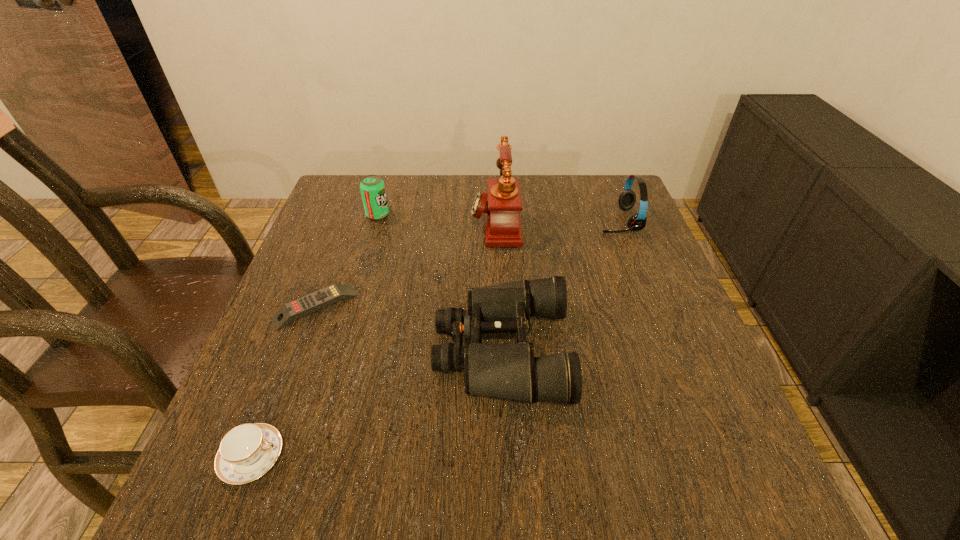
The image size is (960, 540). Identify the location of headset located in the far edge section of the desktop. (627, 199).

The image size is (960, 540). Find the location of `pop soda that is at the far edge`. pop soda that is at the far edge is located at coordinates (372, 187).

Where is `object present at the near edge`? The width and height of the screenshot is (960, 540). object present at the near edge is located at coordinates (x=248, y=451).

The image size is (960, 540). Identify the location of pop soda situated at the left edge. (372, 187).

At what (x,y) coordinates should I click in order to perform the action: click on teacup present at the left edge. Please return your answer as a coordinate pair (x, y). Looking at the image, I should click on (248, 451).

You are a GUI agent. You are given a task and a screenshot of the screen. Output one action in this format:
    pyautogui.click(x=<x>, y=<y>)
    Task: Click on the remote control that is at the left edge
    
    Given the screenshot: What is the action you would take?
    pyautogui.click(x=305, y=305)

Where is `object that is at the right edge`? The width and height of the screenshot is (960, 540). object that is at the right edge is located at coordinates (627, 199).

Identify the location of object that is positioned at the far left corner. The height and width of the screenshot is (540, 960). (372, 187).

This screenshot has width=960, height=540. Find the location of `object that is at the near left corner`. object that is at the near left corner is located at coordinates (248, 451).

Where is `object that is at the far right corner`? The image size is (960, 540). object that is at the far right corner is located at coordinates (627, 199).